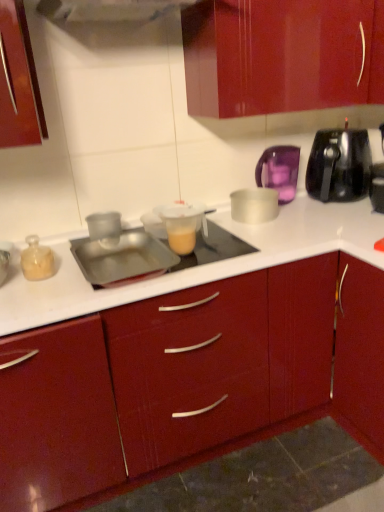
This screenshot has width=384, height=512. Identify the location of vacant area located to the right-hand side of translucent glass jar at left, the 5th kitchen appliance positioned from the right. (71, 277).